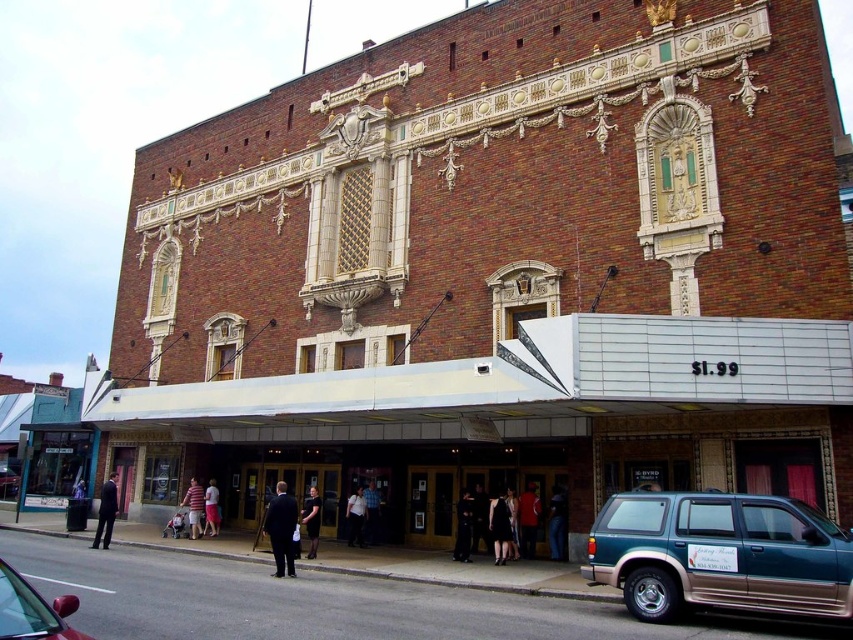
Is black satin dress at center positioned in front of blue denim jeans at center?

Yes, black satin dress at center is closer to the viewer.

From the picture: Between black satin dress at center and blue denim jeans at center, which one has more height?

Standing taller between the two is blue denim jeans at center.

Does point (494, 506) come farther from viewer compared to point (372, 512)?

No, it is in front of (372, 512).

Locate an element on the screen. This screenshot has width=853, height=640. black satin dress at center is located at coordinates (498, 528).

Does shiny red car at lower left have a lesser height compared to striped shirt at center?

No, shiny red car at lower left is not shorter than striped shirt at center.

Who is more forward, [21,595] or [195,536]?

Point [21,595] is in front.

Is point (0, 612) closer to viewer compared to point (193, 477)?

Yes.

Find the location of a particular element. shiny red car at lower left is located at coordinates (32, 611).

Between teal matte suv at lower right and blue denim jeans at center, which one has more height?

Standing taller between the two is teal matte suv at lower right.

Between teal matte suv at lower right and blue denim jeans at center, which one is positioned lower?

blue denim jeans at center is below.

This screenshot has width=853, height=640. Describe the element at coordinates (720, 554) in the screenshot. I see `teal matte suv at lower right` at that location.

The width and height of the screenshot is (853, 640). Identify the location of teal matte suv at lower right. (720, 554).